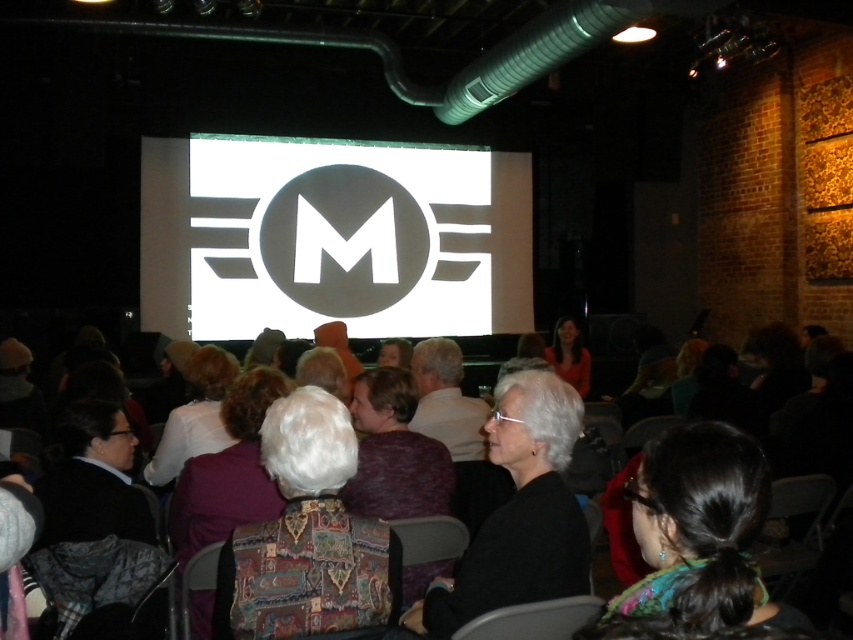
Question: Where is white fabric at center located in relation to matte black jacket at center in the image?

Choices:
 (A) below
 (B) above

Answer: (A)

Question: Which point is farther from the camera taking this photo?

Choices:
 (A) (340, 205)
 (B) (399, 342)

Answer: (A)

Question: Which of the following is the farthest from the observer?

Choices:
 (A) click(x=193, y=387)
 (B) click(x=735, y=566)
 (C) click(x=555, y=346)
 (D) click(x=280, y=444)

Answer: (C)

Question: Which point is closer to the camera?

Choices:
 (A) white matte projection screen at center
 (B) smooth brown hair at center

Answer: (B)

Question: Can you confirm if white matte projection screen at center is bigger than black hair at center?

Choices:
 (A) no
 (B) yes

Answer: (B)

Question: Does black hair at center have a lesser width compared to patterned fabric jacket at center?

Choices:
 (A) yes
 (B) no

Answer: (A)